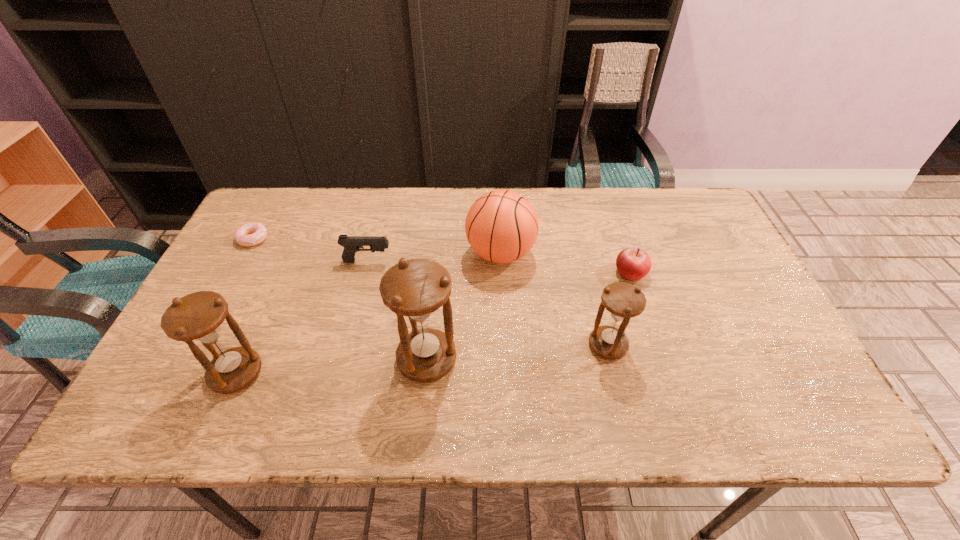
At what (x,y) coordinates should I click in order to perform the action: click on hourglass present at the left edge. Please return your answer as a coordinate pair (x, y). The image size is (960, 540). Looking at the image, I should click on (198, 317).

I want to click on doughnut that is at the left edge, so click(x=250, y=234).

Where is `object present at the far left corner`? This screenshot has height=540, width=960. object present at the far left corner is located at coordinates (250, 234).

What are the coordinates of `object at the near left corner` in the screenshot? It's located at (198, 317).

The image size is (960, 540). Find the location of `free space at the far edge`. free space at the far edge is located at coordinates (623, 233).

At what (x,y) coordinates should I click in order to perform the action: click on vacant region at the near edge. Please return your answer as a coordinate pair (x, y). The width and height of the screenshot is (960, 540). Looking at the image, I should click on (520, 366).

The image size is (960, 540). Find the location of `free space at the left edge`. free space at the left edge is located at coordinates (234, 313).

You are a GUI agent. You are given a task and a screenshot of the screen. Output one action in this format:
    pyautogui.click(x=<x>, y=<y>)
    Task: Click on the free space at the right edge
    Image resolution: width=960 pixels, height=540 pixels.
    Given the screenshot: What is the action you would take?
    pyautogui.click(x=784, y=343)

In the image, there is a desktop. At what (x,y) coordinates should I click in order to perform the action: click on vacant region at the far left corner. Please return your answer as a coordinate pair (x, y). The height and width of the screenshot is (540, 960). Looking at the image, I should click on [x=278, y=200].

The width and height of the screenshot is (960, 540). I want to click on free spot between the basketball and the rightmost object, so click(565, 264).